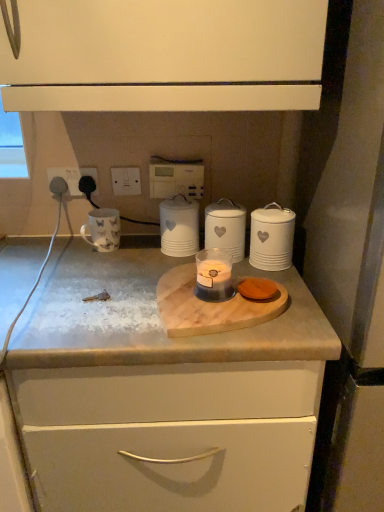
Question: Considering the relative positions of white matte canister at right, which appears as the third home appliance when viewed from the left, and white glossy mug at left in the image provided, is white matte canister at right, which appears as the third home appliance when viewed from the left, to the right of white glossy mug at left from the viewer's perspective?

Choices:
 (A) no
 (B) yes

Answer: (B)

Question: Is white glossy mug at left inside white matte canister at right, which appears as the third home appliance when viewed from the left?

Choices:
 (A) yes
 (B) no

Answer: (B)

Question: Is white matte canister at right, which appears as the third home appliance when viewed from the left, thinner than white glossy mug at left?

Choices:
 (A) yes
 (B) no

Answer: (A)

Question: Does white matte canister at right, the first home appliance when ordered from right to left, lie in front of white glossy mug at left?

Choices:
 (A) no
 (B) yes

Answer: (B)

Question: Does white matte canister at right, the first home appliance when ordered from right to left, appear on the left side of white glossy mug at left?

Choices:
 (A) yes
 (B) no

Answer: (B)

Question: Does white matte canister at right, which appears as the third home appliance when viewed from the left, have a smaller size compared to white glossy mug at left?

Choices:
 (A) yes
 (B) no

Answer: (B)

Question: Considering the relative sizes of white plastic socket at upper left, the 1th electric outlet viewed from the left, and white glossy mug at left in the image provided, is white plastic socket at upper left, the 1th electric outlet viewed from the left, shorter than white glossy mug at left?

Choices:
 (A) yes
 (B) no

Answer: (A)

Question: Does white plastic socket at upper left, positioned as the third electric outlet in right-to-left order, lie in front of white glossy mug at left?

Choices:
 (A) yes
 (B) no

Answer: (B)

Question: From a real-world perspective, is white plastic socket at upper left, positioned as the third electric outlet in right-to-left order, over white glossy mug at left?

Choices:
 (A) no
 (B) yes

Answer: (B)

Question: From the image's perspective, is white plastic socket at upper left, positioned as the third electric outlet in right-to-left order, beneath white glossy mug at left?

Choices:
 (A) no
 (B) yes

Answer: (A)

Question: Are white plastic socket at upper left, the 1th electric outlet viewed from the left, and white glossy mug at left making contact?

Choices:
 (A) no
 (B) yes

Answer: (A)

Question: From a real-world perspective, is white plastic socket at upper left, the 1th electric outlet viewed from the left, located beneath white glossy mug at left?

Choices:
 (A) no
 (B) yes

Answer: (A)

Question: Can you confirm if black plastic socket at upper left, the 2th electric outlet from the right, is positioned to the right of white plastic switch at upper center, positioned as the 3th electric outlet in left-to-right order?

Choices:
 (A) no
 (B) yes

Answer: (A)